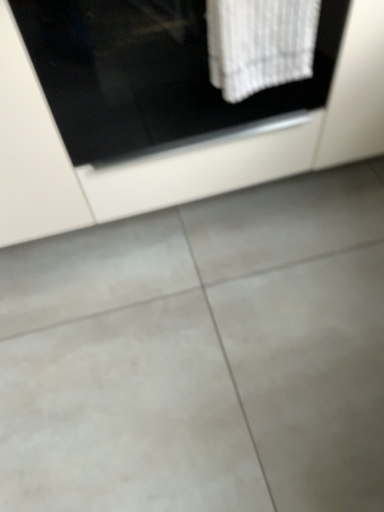
Find the location of a particular element. This screenshot has width=384, height=512. vacant area on top of gray tile floor at center (from a real-world perspective) is located at coordinates (213, 325).